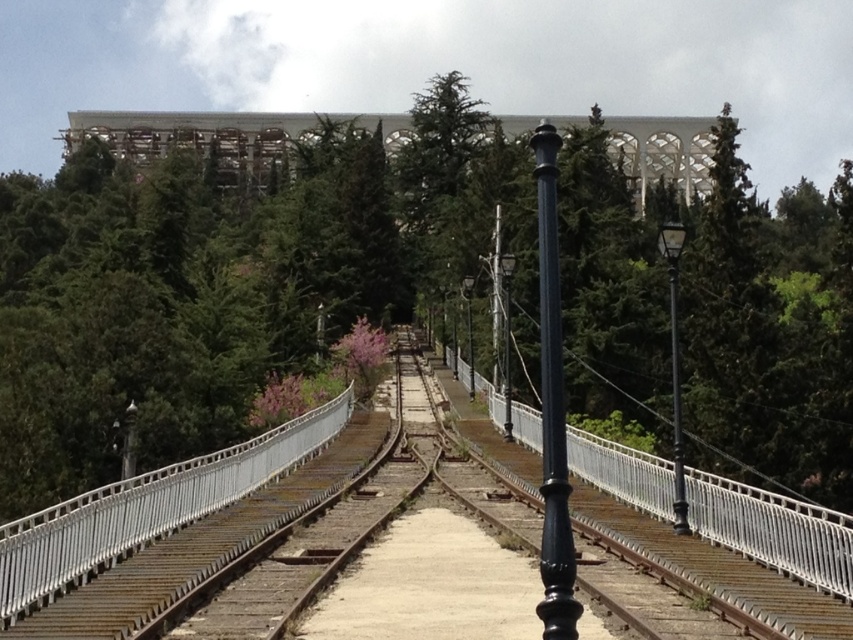
Question: Among these objects, which one is farthest from the camera?

Choices:
 (A) green leafy tree at center
 (B) white concrete bridge at upper center
 (C) black metal rail at center

Answer: (B)

Question: Is white concrete bridge at upper center to the left of black metal rail at center from the viewer's perspective?

Choices:
 (A) yes
 (B) no

Answer: (A)

Question: Which object is positioned farthest from the green leafy tree at center?

Choices:
 (A) white concrete bridge at upper center
 (B) black metal rail at center
 (C) black metal pole at center

Answer: (C)

Question: Can you confirm if black metal rail at center is positioned to the right of black polished metal pole at center?

Choices:
 (A) no
 (B) yes

Answer: (A)

Question: Which point is closer to the camera?

Choices:
 (A) (22, 396)
 (B) (695, 195)
 (C) (614, 520)
 (D) (674, 332)

Answer: (D)

Question: Is the position of white concrete bridge at upper center more distant than that of black metal pole at center?

Choices:
 (A) no
 (B) yes

Answer: (B)